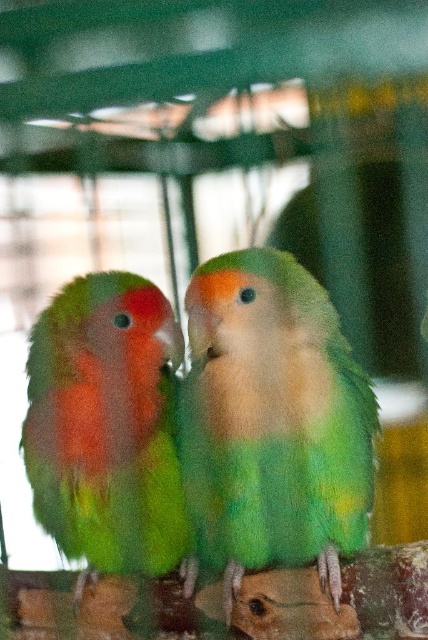
Question: Is green feathered parrot at center smaller than green matte parrot at left?

Choices:
 (A) yes
 (B) no

Answer: (B)

Question: Which point is closer to the camera?

Choices:
 (A) green feathered parrot at center
 (B) green matte parrot at left

Answer: (A)

Question: Which point is farther to the camera?

Choices:
 (A) green feathered parrot at center
 (B) green matte parrot at left

Answer: (B)

Question: Is green feathered parrot at center to the right of green matte parrot at left from the viewer's perspective?

Choices:
 (A) yes
 (B) no

Answer: (A)

Question: Which point is farther to the camera?

Choices:
 (A) green matte parrot at left
 (B) green feathered parrot at center

Answer: (A)

Question: Is green feathered parrot at center further to the viewer compared to green matte parrot at left?

Choices:
 (A) no
 (B) yes

Answer: (A)